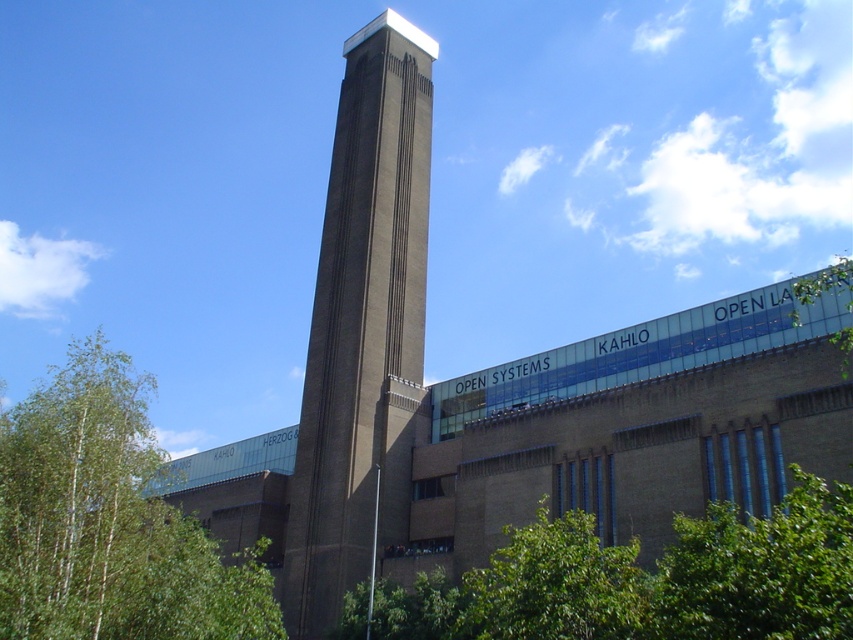
Question: Does brown brick tower at center appear on the right side of green leafy tree at lower left?

Choices:
 (A) yes
 (B) no

Answer: (A)

Question: Does green leafy tree at lower left have a lesser width compared to green leafy tree at lower right?

Choices:
 (A) no
 (B) yes

Answer: (A)

Question: Based on their relative distances, which object is nearer to the green leafy tree at upper right?

Choices:
 (A) green leafy tree at lower right
 (B) brown brick tower at center
 (C) green leafy tree at lower left

Answer: (A)

Question: Which object is the closest to the green leafy tree at lower right?

Choices:
 (A) brown brick tower at center
 (B) green leafy tree at upper right

Answer: (B)

Question: Is brown brick tower at center smaller than green leafy tree at lower right?

Choices:
 (A) yes
 (B) no

Answer: (B)

Question: Estimate the real-world distances between objects in this image. Which object is closer to the brown brick tower at center?

Choices:
 (A) green leafy tree at lower left
 (B) green leafy tree at lower right
 (C) green leafy tree at upper right

Answer: (B)